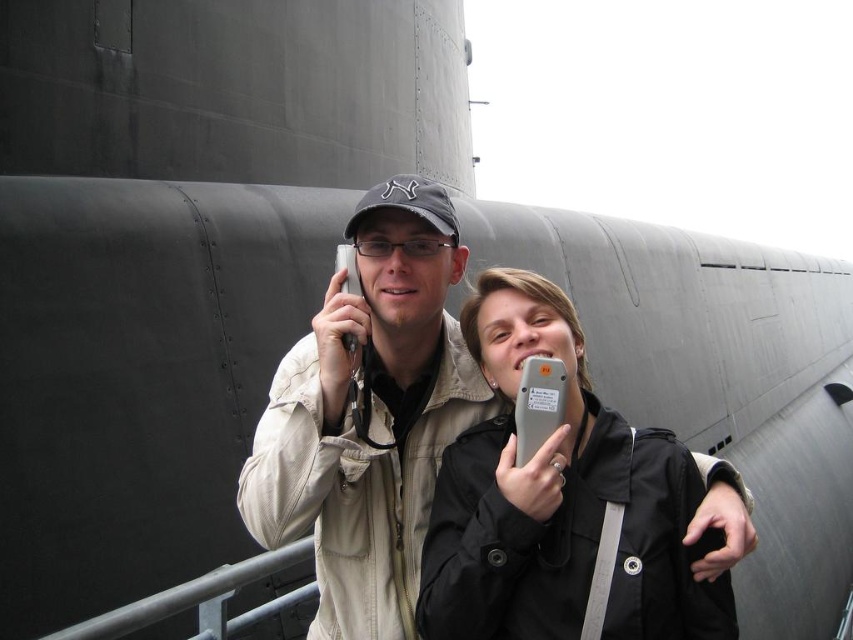
Based on the photo, between black matte jacket at center and matte beige jacket at center, which one appears on the right side from the viewer's perspective?

black matte jacket at center is more to the right.

Does black matte jacket at center appear over matte beige jacket at center?

Actually, black matte jacket at center is below matte beige jacket at center.

Does point (511, 448) come behind point (328, 436)?

Yes, point (511, 448) is farther from viewer.

Where is `black matte jacket at center`? Image resolution: width=853 pixels, height=640 pixels. black matte jacket at center is located at coordinates (560, 502).